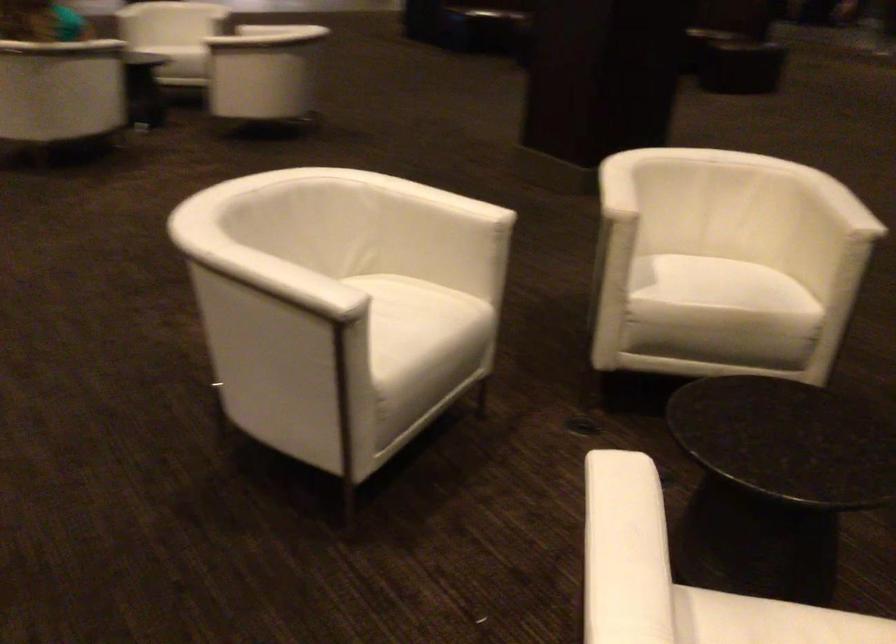
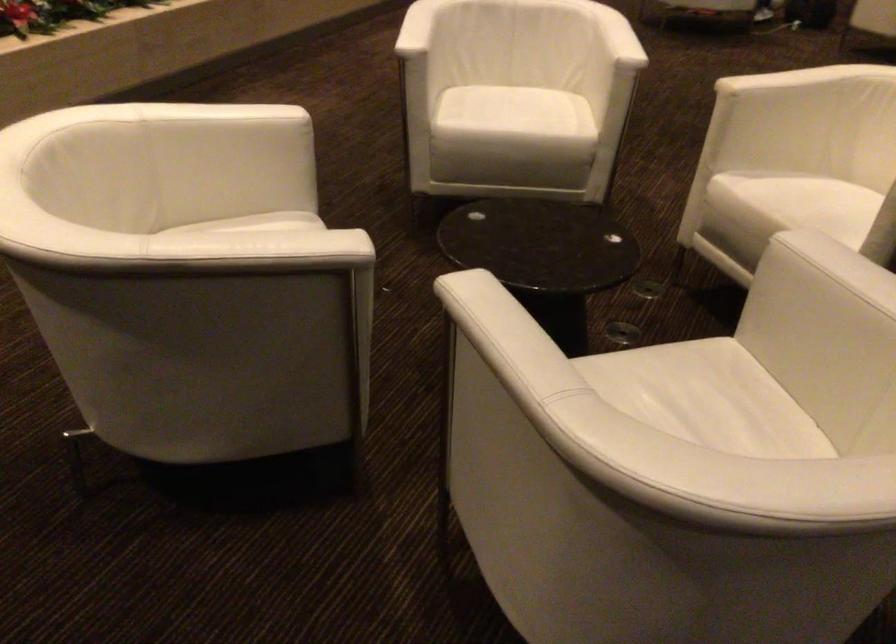
The point at (421, 323) is marked in the first image. Where is the corresponding point in the second image?

(524, 117)